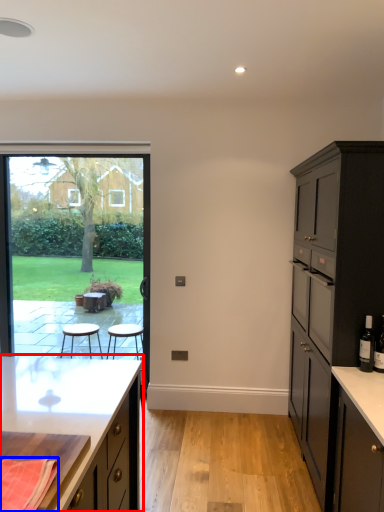
Question: Which object is further to the camera taking this photo, cabinetry (highlighted by a red box) or material (highlighted by a blue box)?

Choices:
 (A) cabinetry
 (B) material

Answer: (A)